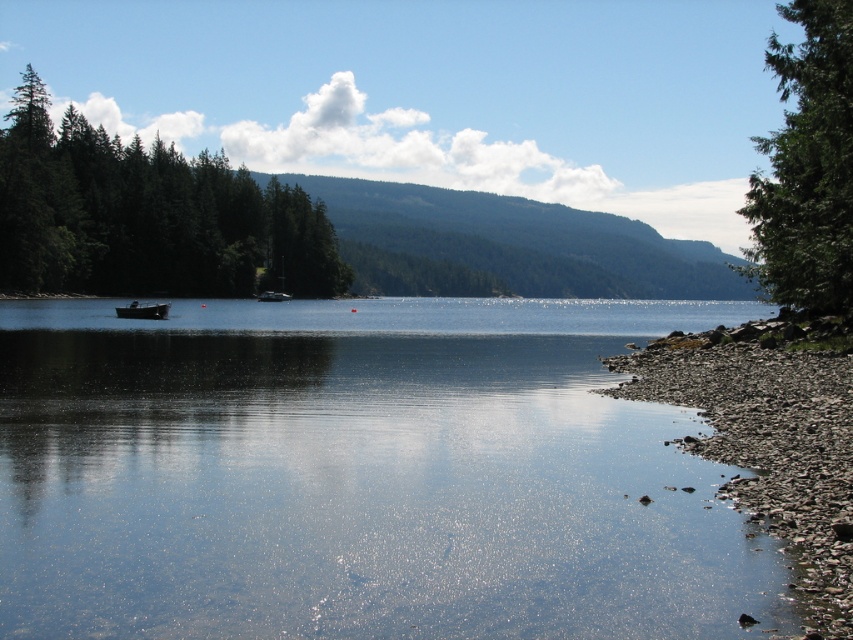
Question: Is smooth pebbles at lower right smaller than green textured tree at right?

Choices:
 (A) no
 (B) yes

Answer: (B)

Question: Which of the following is the farthest from the observer?

Choices:
 (A) metallic gray boat at left
 (B) green matte trees at left
 (C) metallic silver boat at center

Answer: (C)

Question: Does green forested mountain at center appear on the right side of metallic gray boat at left?

Choices:
 (A) no
 (B) yes

Answer: (B)

Question: Is the position of metallic gray boat at left more distant than that of metallic silver boat at center?

Choices:
 (A) no
 (B) yes

Answer: (A)

Question: Which point is closer to the camera?

Choices:
 (A) (721, 460)
 (B) (160, 305)
 (C) (285, 300)

Answer: (A)

Question: Which object is the farthest from the green textured tree at right?

Choices:
 (A) clear water at center
 (B) metallic gray boat at left
 (C) smooth pebbles at lower right

Answer: (B)